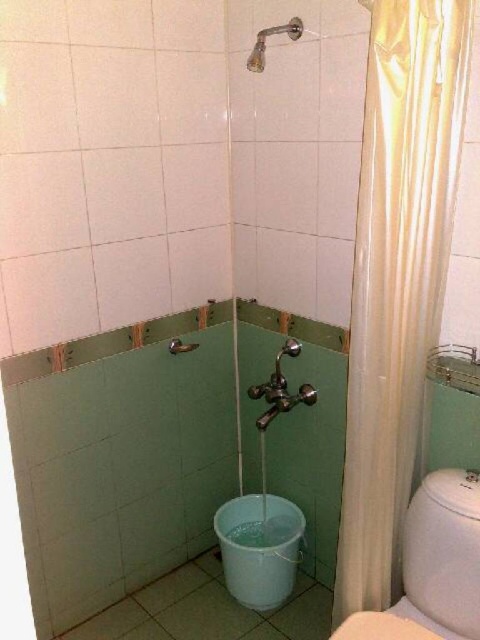
You are a plumber inspecting the bathroom layout. You need to access the pipes behind the matte silver shower at upper center. However, the white glossy toilet bowl at lower center is blocking your path. Can you move the toilet bowl to reach the shower pipes?

The white glossy toilet bowl at lower center is in front of the matte silver shower at upper center, so moving the toilet bowl would allow access to the pipes behind the shower.

You are a cleaning robot with a width of 40 centimeters. You are positioned in the bathroom and need to move from the white satin shower curtain at right to the white glossy toilet bowl at lower center. Can you navigate this path without any obstacles?

The distance between the white satin shower curtain at right and the white glossy toilet bowl at lower center is 52.96 centimeters. Since your width is 40 centimeters, you can navigate this path without any obstacles as the space is sufficient.

Where is the white satin shower curtain at right located in the bathroom?

The white satin shower curtain at right is located at point (397,276) in the bathroom.